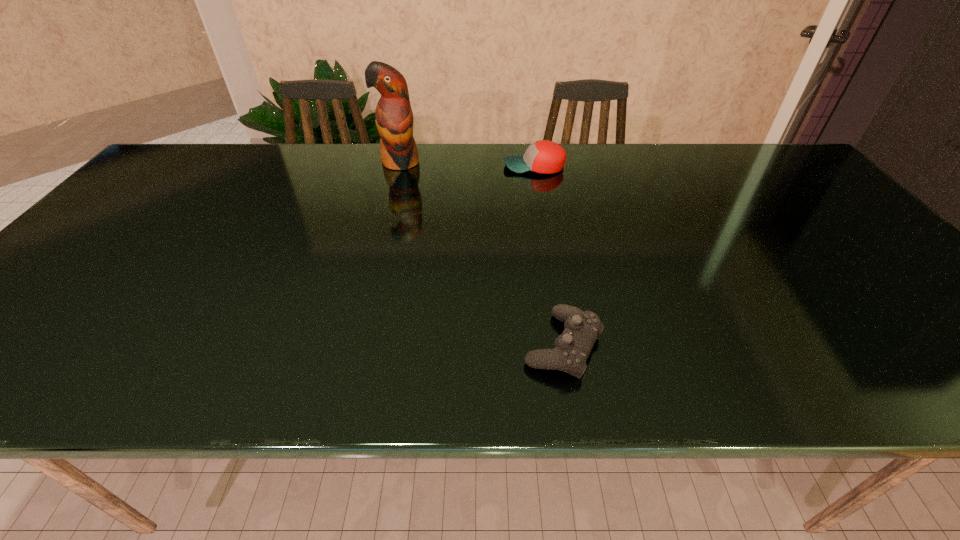
This screenshot has height=540, width=960. What are the coordinates of `the tallest object` in the screenshot? It's located at (394, 119).

Where is `parrot`? Image resolution: width=960 pixels, height=540 pixels. parrot is located at coordinates (394, 119).

Find the location of a particular element. The width and height of the screenshot is (960, 540). baseball cap is located at coordinates (544, 156).

Where is `the shortest object`? the shortest object is located at coordinates pos(572,348).

At what (x,y) coordinates should I click in order to perform the action: click on control. Please return your answer as a coordinate pair (x, y). Looking at the image, I should click on (572, 348).

Where is `free point located 0.290m on the face of the tallest object`? free point located 0.290m on the face of the tallest object is located at coordinates (381, 234).

The height and width of the screenshot is (540, 960). Identify the location of free spot located 0.220m at the brim of the baseball cap. (433, 166).

Identify the location of vacant space located at the brim of the baseball cap. This screenshot has height=540, width=960. pos(433,166).

You are a GUI agent. You are given a task and a screenshot of the screen. Output one action in this format:
    pyautogui.click(x=<x>, y=<y>)
    Task: Click on the vacant space located at the brim of the baseball cap
    The width and height of the screenshot is (960, 540).
    Given the screenshot: What is the action you would take?
    pyautogui.click(x=439, y=166)

This screenshot has width=960, height=540. I want to click on blank space located 0.200m on the left of the control, so click(421, 345).